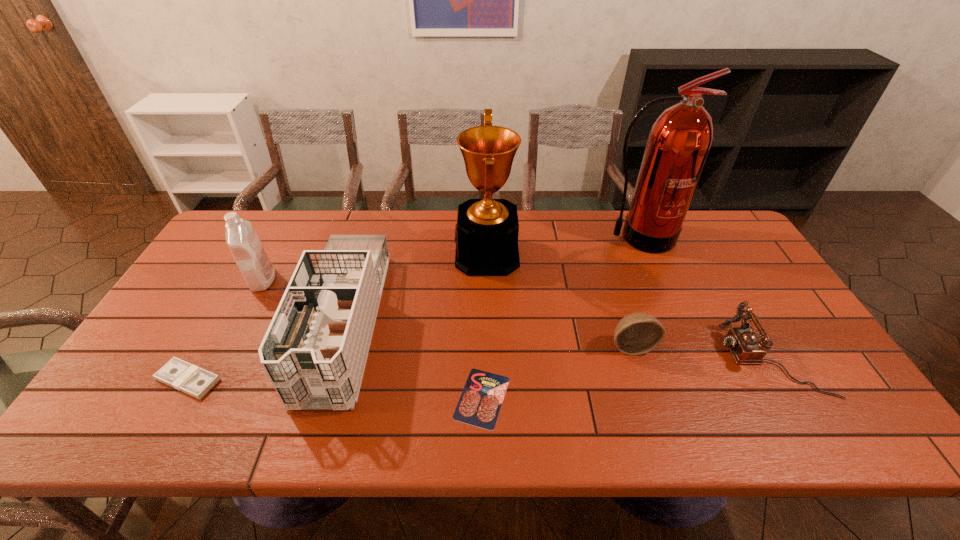
At what (x,y) coordinates should I click in order to perform the action: click on free spot at the right edge of the desktop. Please return your answer as a coordinate pair (x, y). The width and height of the screenshot is (960, 540). Looking at the image, I should click on (796, 395).

Identify the location of free space at the far right corner. The image size is (960, 540). (706, 237).

Where is `empty space between the telephone and the trophy cup`? This screenshot has height=540, width=960. empty space between the telephone and the trophy cup is located at coordinates (629, 307).

At what (x,y) coordinates should I click in order to perform the action: click on empty location between the detergent and the dollar. Please return your answer as a coordinate pair (x, y). This screenshot has height=540, width=960. Looking at the image, I should click on (226, 330).

Locate an element on the screen. Image resolution: width=960 pixels, height=540 pixels. empty space between the dollhouse and the second tallest object is located at coordinates (416, 289).

Where is `blank region between the sixth shortest object and the shortest object`? blank region between the sixth shortest object and the shortest object is located at coordinates [372, 339].

Image resolution: width=960 pixels, height=540 pixels. What are the coordinates of `vacant area between the seventh shortest object and the bowl` in the screenshot? It's located at (560, 300).

At what (x,y) coordinates should I click in order to perform the action: click on free space between the seventh tallest object and the detergent. Please return your answer as a coordinate pair (x, y). This screenshot has width=960, height=540. Looking at the image, I should click on (226, 330).

Image resolution: width=960 pixels, height=540 pixels. Identify the location of vacant area between the third tallest object and the bowl. (447, 313).

This screenshot has width=960, height=540. Identify the location of vacant area that lies between the tallest object and the trophy cup. point(563,246).